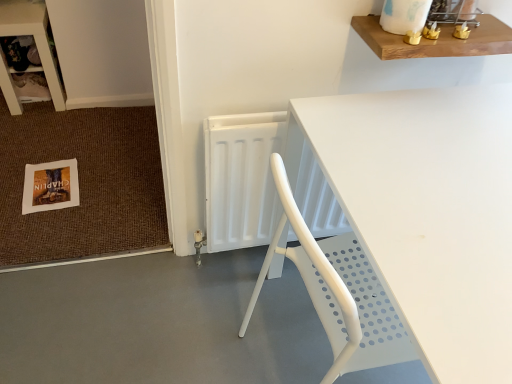
I want to click on vacant area that is in front of wooden shelf at upper left, so click(42, 133).